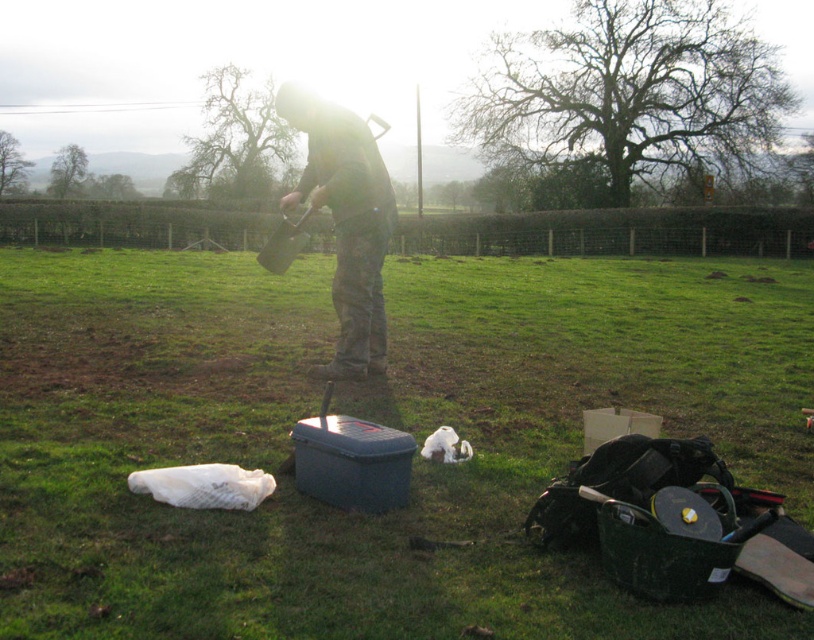
Question: Does matte black tool box at center have a larger size compared to camouflage fabric shirt at center?

Choices:
 (A) yes
 (B) no

Answer: (A)

Question: Which point is closer to the camera?

Choices:
 (A) matte black tool box at center
 (B) camouflage fabric shirt at center

Answer: (A)

Question: Is matte black tool box at center smaller than camouflage fabric shirt at center?

Choices:
 (A) no
 (B) yes

Answer: (A)

Question: Is matte black tool box at center below camouflage fabric shirt at center?

Choices:
 (A) yes
 (B) no

Answer: (B)

Question: Which of the following is the closest to the observer?

Choices:
 (A) (521, 596)
 (B) (357, 330)

Answer: (A)